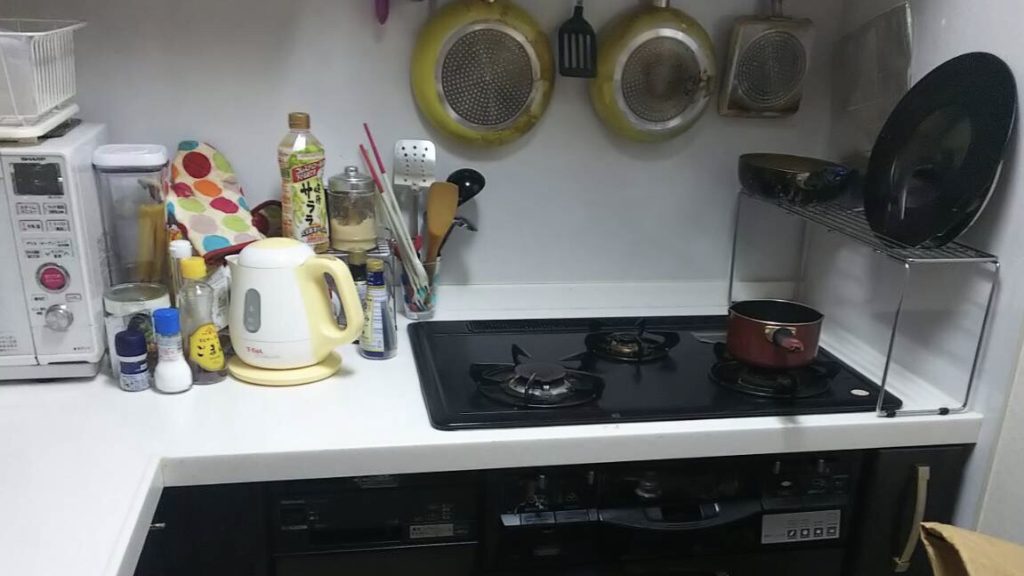
Identify the location of stove top. (646, 382).